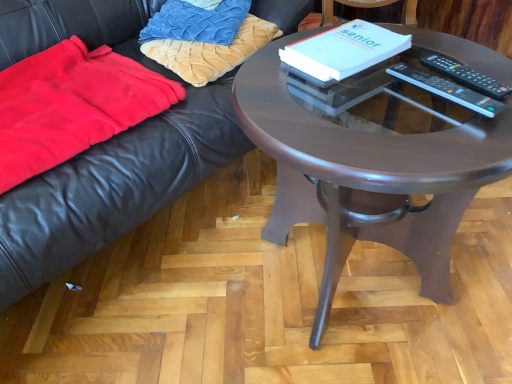
Identify the location of free region under matte brown table at center (from a real-world perspective). The width and height of the screenshot is (512, 384). (345, 291).